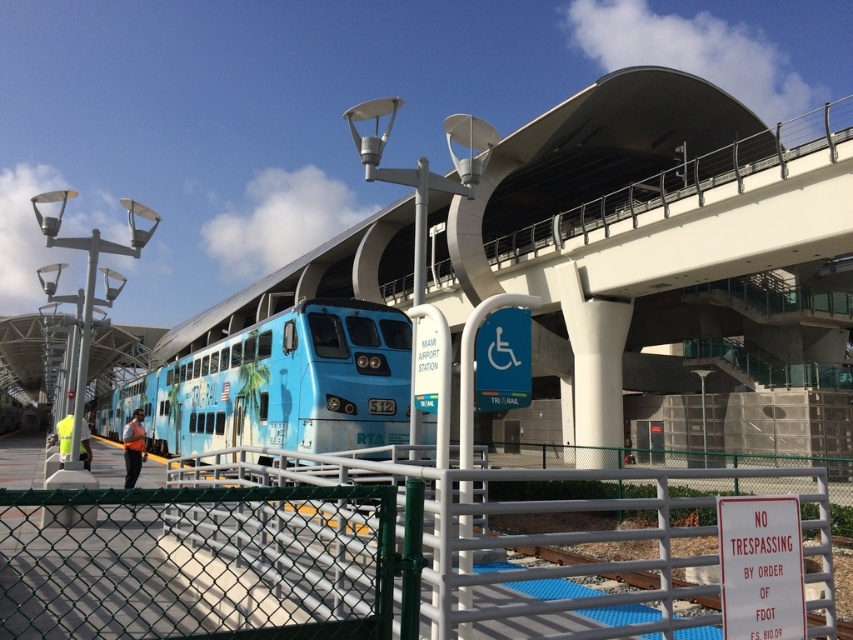
Question: Among these objects, which one is farthest from the camera?

Choices:
 (A) orange reflective vest at lower left
 (B) neon yellow vest at lower left
 (C) green chain-link fence at center
 (D) blue glossy train at center

Answer: (A)

Question: Can you confirm if green chain-link fence at center is bigger than neon yellow vest at lower left?

Choices:
 (A) no
 (B) yes

Answer: (B)

Question: Which point is farther to the camera?

Choices:
 (A) (49, 506)
 (B) (128, 472)

Answer: (B)

Question: Can you confirm if blue glossy train at center is bigger than orange reflective vest at lower left?

Choices:
 (A) yes
 (B) no

Answer: (A)

Question: Which object appears farthest from the camera in this image?

Choices:
 (A) neon yellow vest at lower left
 (B) blue glossy train at center
 (C) orange reflective vest at lower left
 (D) green chain-link fence at center

Answer: (C)

Question: Does green chain-link fence at center appear over neon yellow vest at lower left?

Choices:
 (A) no
 (B) yes

Answer: (B)